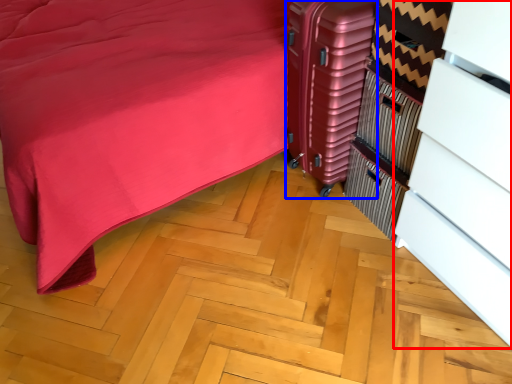
Question: Which of the following is the farthest to the observer, dresser (highlighted by a red box) or luggage (highlighted by a blue box)?

Choices:
 (A) dresser
 (B) luggage

Answer: (B)